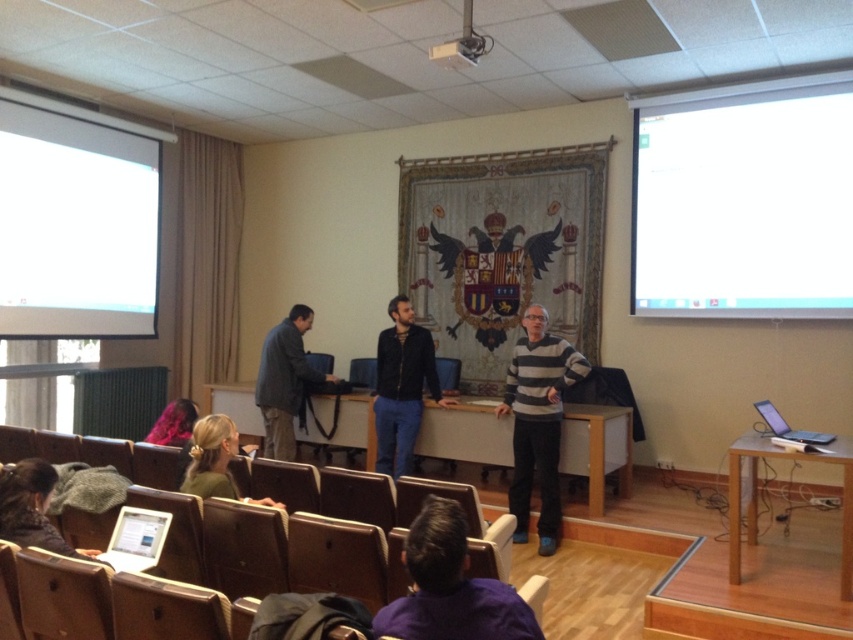
You are standing in the classroom and want to move from point A to point B. Point A is located at coordinates point [283,417] and point B is at point [233,428]. Which point is closer to you when you are facing the front of the room?

Point [283,417] is further to the viewer than point [233,428], so point B is closer to you.

You are a student sitting in the classroom and need to hand in an assignment. You see the dark gray fabric jacket at center and the green matte sweater at lower left. Which clothing item is closer to the ceiling?

The dark gray fabric jacket at center is located above the green matte sweater at lower left, so it is closer to the ceiling.